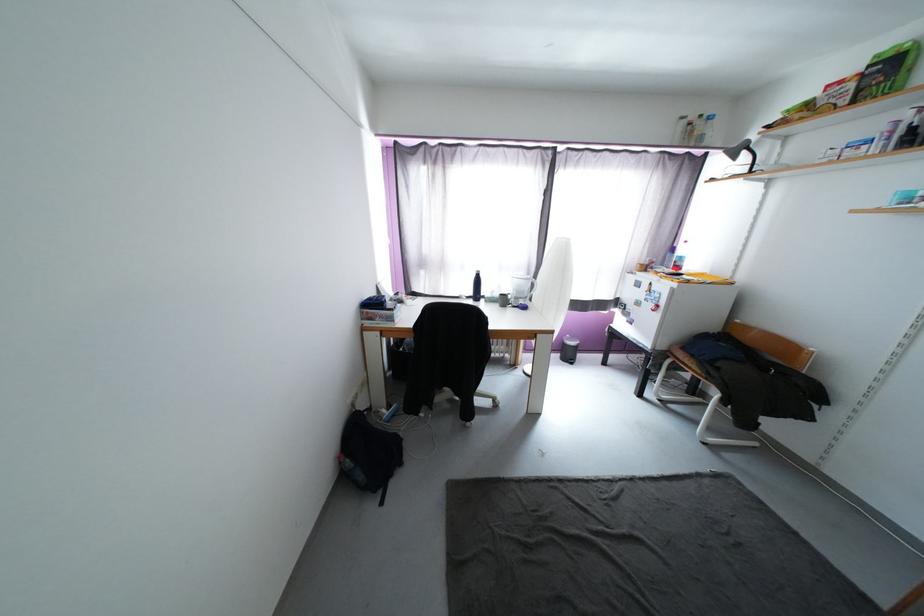
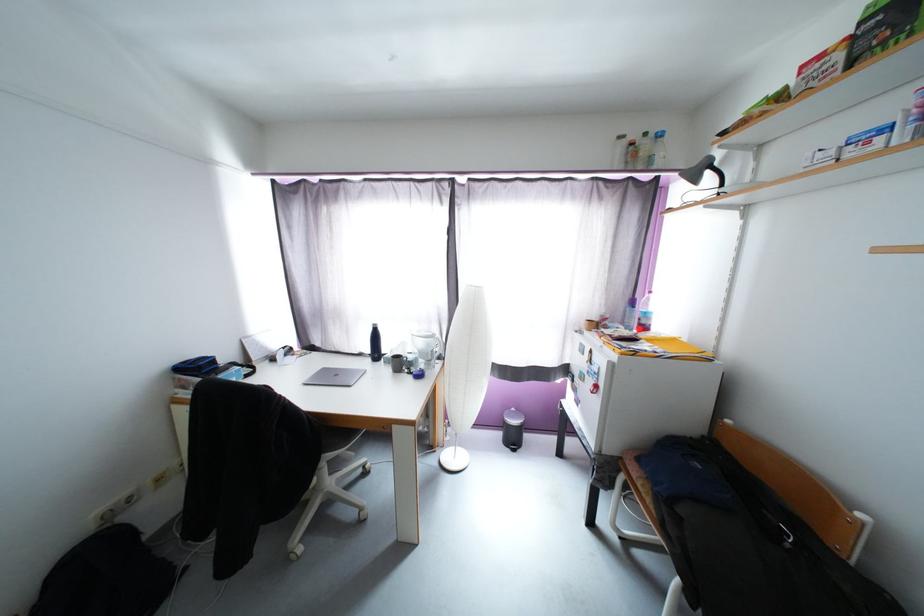
Find the pixel in the second image that matches [480,277] in the first image.

(377, 331)